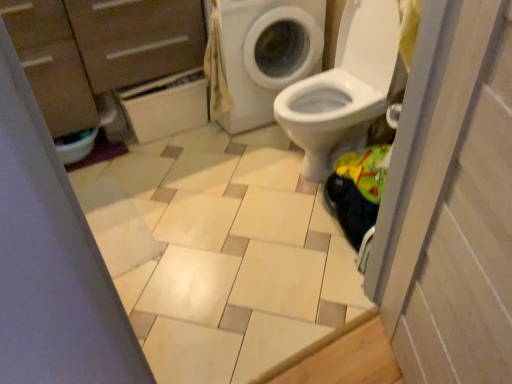
Describe the element at coordinates (100, 53) in the screenshot. The image size is (512, 384). I see `brown wood dresser at upper left` at that location.

You are a GUI agent. You are given a task and a screenshot of the screen. Output one action in this format:
    pyautogui.click(x=<x>, y=<y>)
    Task: Click on the brown wood dresser at upper left
    
    Given the screenshot: What is the action you would take?
    pyautogui.click(x=100, y=53)

Describe the element at coordinates (220, 252) in the screenshot. I see `beige glossy tile at center` at that location.

Describe the element at coordinates (458, 212) in the screenshot. I see `white glossy screen door at right` at that location.

The image size is (512, 384). What are the coordinates of `white glossy washing machine at upper right` in the screenshot? It's located at (264, 54).

What's the angular difference between white glossy screen door at right and brown wood dresser at upper left's facing directions?

The angular difference between white glossy screen door at right and brown wood dresser at upper left is 117 degrees.

Are white glossy screen door at right and brown wood dresser at upper left far apart?

Absolutely, white glossy screen door at right is distant from brown wood dresser at upper left.

Is white glossy screen door at right completely or partially outside of brown wood dresser at upper left?

Yes.

Based on the photo, is white glossy washing machine at upper right next to beige glossy tile at center and touching it?

No, white glossy washing machine at upper right is not touching beige glossy tile at center.

Is white glossy washing machine at upper right to the right of beige glossy tile at center from the viewer's perspective?

Correct, you'll find white glossy washing machine at upper right to the right of beige glossy tile at center.

In terms of width, does white glossy screen door at right look wider or thinner when compared to beige glossy tile at center?

Clearly, white glossy screen door at right has less width compared to beige glossy tile at center.

Consider the image. Is beige glossy tile at center inside white glossy screen door at right?

No, beige glossy tile at center is not inside white glossy screen door at right.

Between white glossy screen door at right and beige glossy tile at center, which one has more height?

white glossy screen door at right is taller.

From a real-world perspective, relative to beige glossy tile at center, is white glossy screen door at right vertically above or below?

white glossy screen door at right is above beige glossy tile at center.

The width and height of the screenshot is (512, 384). What are the coordinates of `dresser above the white matte cabinet at upper left (from the image's perspective)` in the screenshot? It's located at (100, 53).

Can you confirm if white matte cabinet at upper left is thinner than brown wood dresser at upper left?

Yes.

From a real-world perspective, which is physically above, white matte cabinet at upper left or brown wood dresser at upper left?

brown wood dresser at upper left.

Is white matte cabinet at upper left aimed at brown wood dresser at upper left?

Yes, white matte cabinet at upper left is aimed at brown wood dresser at upper left.

From the image's perspective, between brown wood dresser at upper left and white matte cabinet at upper left, which one is located above?

brown wood dresser at upper left, from the image's perspective.

Is point (199, 46) farther from viewer compared to point (181, 104)?

No, (199, 46) is closer to viewer.

Between brown wood dresser at upper left and white matte cabinet at upper left, which one is positioned in front?

brown wood dresser at upper left is closer to the camera.

Do you think brown wood dresser at upper left is within white matte cabinet at upper left, or outside of it?

brown wood dresser at upper left is not inside white matte cabinet at upper left, it's outside.

From a real-world perspective, who is located higher, beige glossy tile at center or white glossy screen door at right?

From a 3D spatial view, white glossy screen door at right is above.

Is the depth of beige glossy tile at center less than that of white glossy screen door at right?

No, the depth of beige glossy tile at center is greater than that of white glossy screen door at right.

Does point (199, 258) appear closer or farther from the camera than point (419, 349)?

Point (199, 258) is farther from the camera than point (419, 349).

Is beige glossy tile at center inside or outside of white glossy screen door at right?

beige glossy tile at center is located beyond the bounds of white glossy screen door at right.

Does brown wood dresser at upper left appear on the right side of white glossy washing machine at upper right?

No.

Between brown wood dresser at upper left and white glossy washing machine at upper right, which one has larger width?

white glossy washing machine at upper right.

Can you tell me how much brown wood dresser at upper left and white glossy washing machine at upper right differ in facing direction?

brown wood dresser at upper left and white glossy washing machine at upper right are facing 0.000351 degrees away from each other.

You are a GUI agent. You are given a task and a screenshot of the screen. Output one action in this format:
    pyautogui.click(x=<x>, y=<y>)
    Task: Click on the screen door located on the right of brown wood dresser at upper left
    The image size is (512, 384).
    Given the screenshot: What is the action you would take?
    pyautogui.click(x=458, y=212)

In the image, there is a white glossy washing machine at upper right. Identify the location of ceramic tile below it (from a real-world perspective). (220, 252).

Looking at the image, which one is located closer to brown wood dresser at upper left, beige glossy tile at center or white matte cabinet at upper left?

Based on the image, white matte cabinet at upper left appears to be nearer to brown wood dresser at upper left.

Estimate the real-world distances between objects in this image. Which object is closer to beige glossy tile at center, white glossy screen door at right or white glossy washing machine at upper right?

Based on the image, white glossy washing machine at upper right appears to be nearer to beige glossy tile at center.

From the picture: Which object lies further to the anchor point white glossy screen door at right, brown wood dresser at upper left or white matte cabinet at upper left?

Based on the image, white matte cabinet at upper left appears to be further to white glossy screen door at right.

When comparing their distances from brown wood dresser at upper left, does white matte cabinet at upper left or white glossy washing machine at upper right seem further?

The object further to brown wood dresser at upper left is white glossy washing machine at upper right.

Estimate the real-world distances between objects in this image. Which object is closer to beige glossy tile at center, white matte cabinet at upper left or brown wood dresser at upper left?

white matte cabinet at upper left is closer to beige glossy tile at center.

Estimate the real-world distances between objects in this image. Which object is further from beige glossy tile at center, white matte cabinet at upper left or white glossy washing machine at upper right?

white glossy washing machine at upper right lies further to beige glossy tile at center than the other object.

Which object lies further to the anchor point beige glossy tile at center, white glossy washing machine at upper right or brown wood dresser at upper left?

brown wood dresser at upper left.

Estimate the real-world distances between objects in this image. Which object is further from white glossy washing machine at upper right, white matte cabinet at upper left or brown wood dresser at upper left?

brown wood dresser at upper left.

The image size is (512, 384). What are the coordinates of `dresser between beige glossy tile at center and white matte cabinet at upper left along the z-axis` in the screenshot? It's located at (100, 53).

Locate an element on the screen. The height and width of the screenshot is (384, 512). ceramic tile between white glossy screen door at right and white matte cabinet at upper left along the z-axis is located at coordinates (220, 252).

Locate an element on the screen. ceramic tile between white glossy screen door at right and white glossy washing machine at upper right along the z-axis is located at coordinates (220, 252).

Locate an element on the screen. The image size is (512, 384). dresser located between white glossy screen door at right and white matte cabinet at upper left in the depth direction is located at coordinates (100, 53).